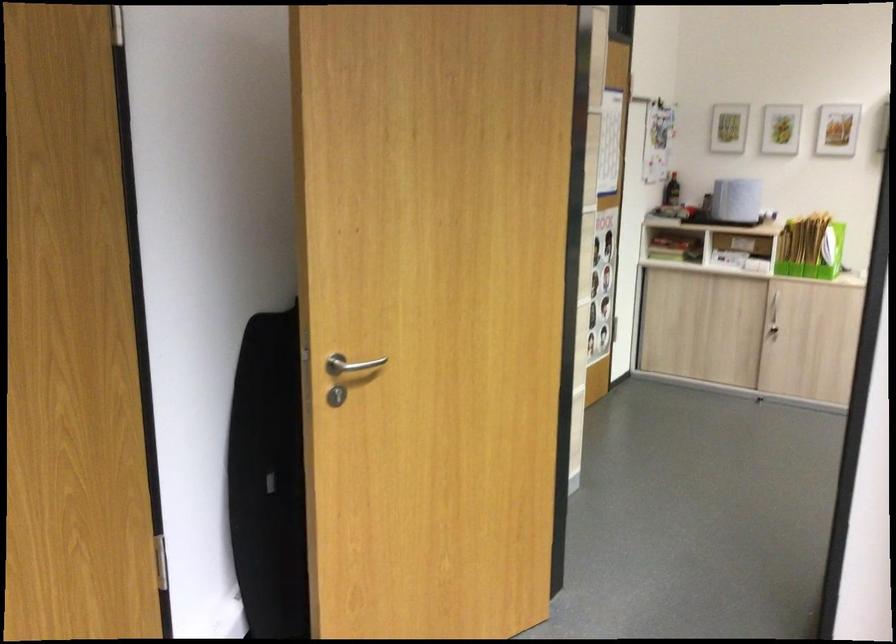
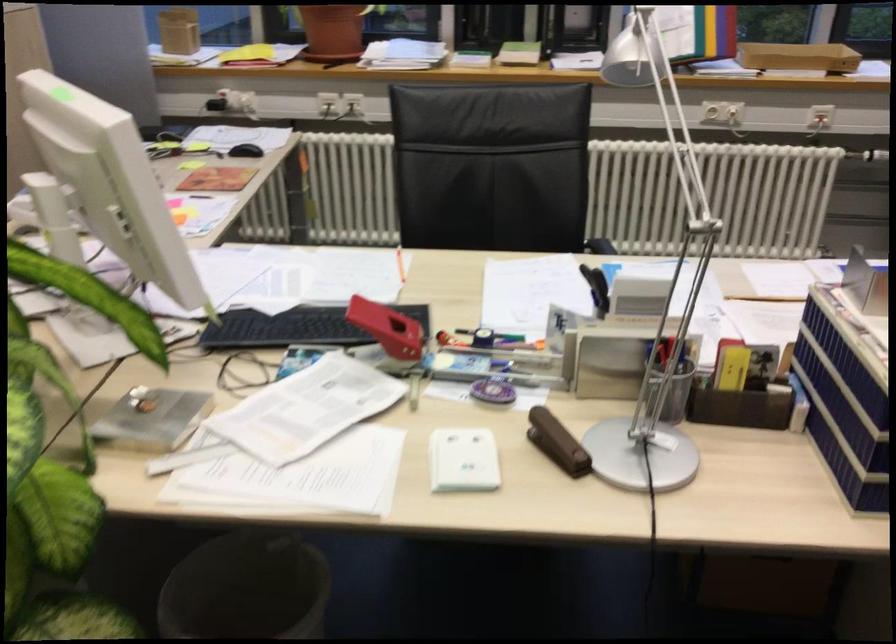
First-person continuous shooting, in which direction is the camera rotating?

The camera rotated toward right-down.